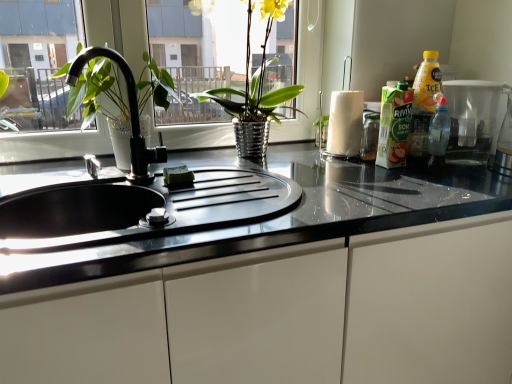
Question: From the image's perspective, relative to transparent plastic bottle at right, is shiny metallic vase at center above or below?

Choices:
 (A) above
 (B) below

Answer: (A)

Question: In terms of width, does shiny metallic vase at center look wider or thinner when compared to transparent plastic bottle at right?

Choices:
 (A) thin
 (B) wide

Answer: (B)

Question: Based on their relative distances, which object is farther from the glossy white cabinet at center?

Choices:
 (A) translucent plastic bottle at right
 (B) black matte faucet at center
 (C) white glossy paper towel at center right
 (D) transparent plastic bottle at right
 (E) translucent plastic container at right

Answer: (B)

Question: Estimate the real-world distances between objects in this image. Which object is closer to the shiny metallic vase at center?

Choices:
 (A) glossy white cabinet at center
 (B) translucent plastic bottle at right
 (C) translucent plastic container at right
 (D) white glossy paper towel at center right
 (E) black matte faucet at center

Answer: (D)